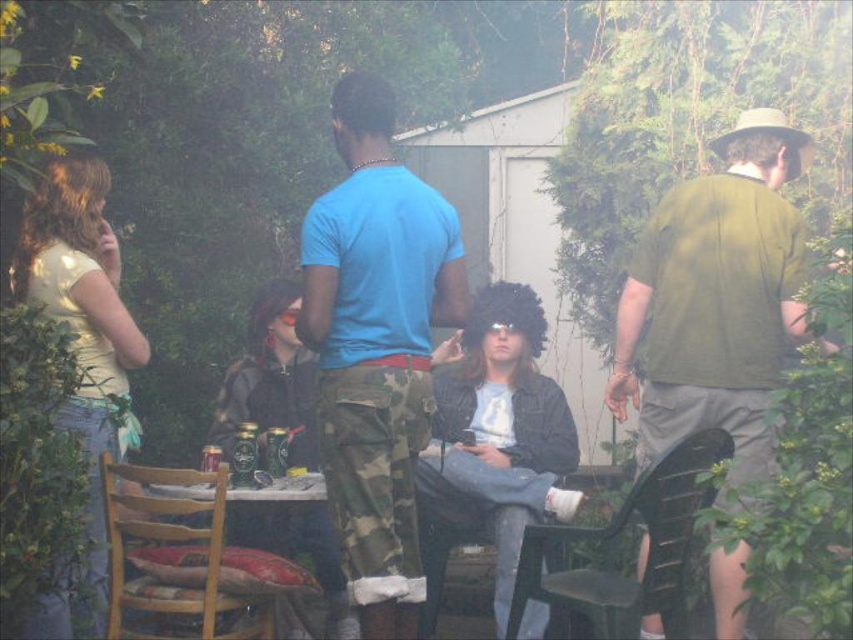
You are a photographer trying to capture a candid shot of the green matte shirt at right and the black plastic chair at lower right. Since the camera can only focus on one subject at a time, which object should you prioritize to ensure it appears clearer in the photo?

The green matte shirt at right is larger in size than the black plastic chair at lower right, so you should prioritize focusing on the green matte shirt at right to ensure it appears clearer in the photo.

You are standing at the entrance of the backyard and want to see the green matte shirt at right without moving your head. Can you see the wooden chair at lower left at the same time?

The wooden chair at lower left is behind the green matte shirt at right, so you cannot see the wooden chair at lower left at the same time while looking at the green matte shirt at right.

You are organizing a small gathering and want to ensure there is enough space for both the green matte shirt at right and the wooden chair at lower left. Based on their sizes, which one requires more space horizontally?

The green matte shirt at right requires more horizontal space since its width is larger than that of the wooden chair at lower left.